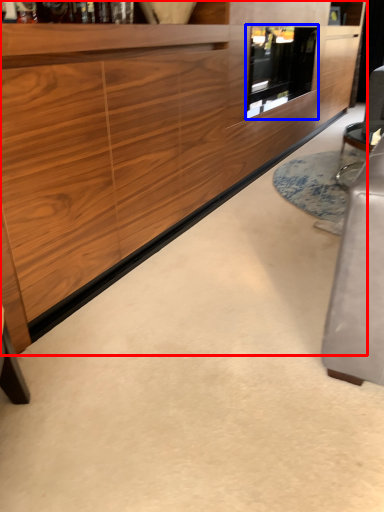
Question: Which object is further to the camera taking this photo, cabinetry (highlighted by a red box) or glass door (highlighted by a blue box)?

Choices:
 (A) cabinetry
 (B) glass door

Answer: (B)